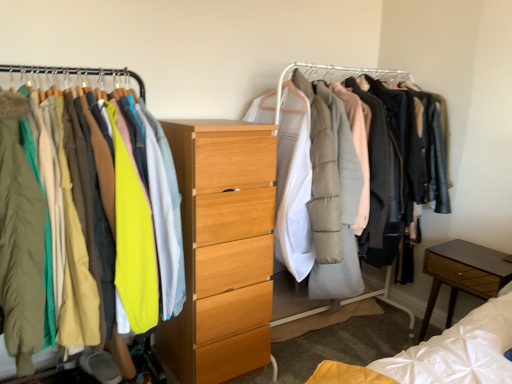
You are a GUI agent. You are given a task and a screenshot of the screen. Output one action in this format:
    pyautogui.click(x=<x>, y=<y>)
    Task: Click on the matte green coat at left, the 1th clothing positioned from the front
    The image size is (512, 384).
    Given the screenshot: What is the action you would take?
    pyautogui.click(x=20, y=240)

The image size is (512, 384). What do you see at coordinates (463, 274) in the screenshot?
I see `brown wood nightstand at lower right` at bounding box center [463, 274].

The image size is (512, 384). What do you see at coordinates (222, 249) in the screenshot?
I see `light wood chest of drawers at center` at bounding box center [222, 249].

The height and width of the screenshot is (384, 512). Find the location of `matte yellow jacket at left, the 3th clothing in the front-to-back sequence`. matte yellow jacket at left, the 3th clothing in the front-to-back sequence is located at coordinates (133, 240).

Is matte green coat at left, the 1th clothing positioned from the front, further to camera compared to matte yellow jacket at left, placed as the second clothing when sorted from front to back?

No, matte green coat at left, the 1th clothing positioned from the front, is in front of matte yellow jacket at left, placed as the second clothing when sorted from front to back.

Can you tell me how much matte green coat at left, the 1th clothing positioned from the front, and matte yellow jacket at left, placed as the second clothing when sorted from front to back, differ in facing direction?

The angle between the facing direction of matte green coat at left, the 1th clothing positioned from the front, and the facing direction of matte yellow jacket at left, placed as the second clothing when sorted from front to back, is 1.61 degrees.

Would you say matte green coat at left, the 1th clothing positioned from the front, is outside matte yellow jacket at left, the 2th clothing when ordered from back to front?

No, matte green coat at left, the 1th clothing positioned from the front, is not entirely external to matte yellow jacket at left, the 2th clothing when ordered from back to front.

Consider the image. From the image's perspective, does matte green coat at left, the 1th clothing positioned from the front, appear lower than matte yellow jacket at left, placed as the second clothing when sorted from front to back?

No.

From a real-world perspective, relative to matte white coat rack at center, is matte yellow jacket at left, placed as the 1th clothing when sorted from back to front, vertically above or below?

From a real-world perspective, matte yellow jacket at left, placed as the 1th clothing when sorted from back to front, is physically above matte white coat rack at center.

How different are the orientations of matte yellow jacket at left, the 3th clothing in the front-to-back sequence, and matte white coat rack at center in degrees?

0.515 degrees separate the facing orientations of matte yellow jacket at left, the 3th clothing in the front-to-back sequence, and matte white coat rack at center.

Is matte yellow jacket at left, the 3th clothing in the front-to-back sequence, positioned far away from matte white coat rack at center?

They are positioned close to each other.

Considering the relative sizes of matte yellow jacket at left, placed as the 1th clothing when sorted from back to front, and matte white coat rack at center in the image provided, is matte yellow jacket at left, placed as the 1th clothing when sorted from back to front, taller than matte white coat rack at center?

No, matte yellow jacket at left, placed as the 1th clothing when sorted from back to front, is not taller than matte white coat rack at center.

From the picture: Between matte yellow jacket at left, the 3th clothing in the front-to-back sequence, and matte yellow jacket at left, the 2th clothing when ordered from back to front, which one has smaller width?

matte yellow jacket at left, the 2th clothing when ordered from back to front, is thinner.

Which is correct: matte yellow jacket at left, the 3th clothing in the front-to-back sequence, is inside matte yellow jacket at left, the 2th clothing when ordered from back to front, or outside of it?

matte yellow jacket at left, the 3th clothing in the front-to-back sequence, is spatially positioned inside matte yellow jacket at left, the 2th clothing when ordered from back to front.

Considering the positions of objects matte yellow jacket at left, placed as the second clothing when sorted from front to back, and matte yellow jacket at left, the 3th clothing in the front-to-back sequence, in the image provided, who is behind, matte yellow jacket at left, placed as the second clothing when sorted from front to back, or matte yellow jacket at left, the 3th clothing in the front-to-back sequence,?

matte yellow jacket at left, the 3th clothing in the front-to-back sequence.

Who is shorter, matte yellow jacket at left, the 2th clothing when ordered from back to front, or matte yellow jacket at left, the 3th clothing in the front-to-back sequence?

With less height is matte yellow jacket at left, the 3th clothing in the front-to-back sequence.

From a real-world perspective, is matte yellow jacket at left, placed as the second clothing when sorted from front to back, above or below matte yellow jacket at left, placed as the 1th clothing when sorted from back to front?

matte yellow jacket at left, placed as the second clothing when sorted from front to back, is below matte yellow jacket at left, placed as the 1th clothing when sorted from back to front.

Is matte yellow jacket at left, the 2th clothing when ordered from back to front, thinner than matte yellow jacket at left, the 3th clothing in the front-to-back sequence?

Yes, matte yellow jacket at left, the 2th clothing when ordered from back to front, is thinner than matte yellow jacket at left, the 3th clothing in the front-to-back sequence.

Is matte white coat rack at center in front of or behind brown wood nightstand at lower right in the image?

In the image, matte white coat rack at center appears in front of brown wood nightstand at lower right.

Which of these two, matte white coat rack at center or brown wood nightstand at lower right, is wider?

Wider between the two is matte white coat rack at center.

Looking at this image, is the surface of matte white coat rack at center in direct contact with brown wood nightstand at lower right?

No.

Based on the photo, is matte white coat rack at center shorter than brown wood nightstand at lower right?

No.

Considering the sizes of objects matte white coat rack at center and light wood chest of drawers at center in the image provided, who is bigger, matte white coat rack at center or light wood chest of drawers at center?

matte white coat rack at center is bigger.

From the image's perspective, is matte white coat rack at center located beneath light wood chest of drawers at center?

Incorrect, from the image's perspective, matte white coat rack at center is higher than light wood chest of drawers at center.

Is matte white coat rack at center not within light wood chest of drawers at center?

Yes, matte white coat rack at center is outside of light wood chest of drawers at center.

From the image's perspective, which object appears higher, brown wood nightstand at lower right or matte green coat at left, the 1th clothing positioned from the front?

From the image's view, matte green coat at left, the 1th clothing positioned from the front, is above.

Can you see brown wood nightstand at lower right touching matte green coat at left, the 3th clothing when ordered from back to front?

brown wood nightstand at lower right is not next to matte green coat at left, the 3th clothing when ordered from back to front, and they're not touching.

Which object is wider, brown wood nightstand at lower right or matte green coat at left, the 1th clothing positioned from the front?

With larger width is matte green coat at left, the 1th clothing positioned from the front.

Is point (459, 248) closer or farther from the camera than point (42, 277)?

Clearly, point (459, 248) is more distant from the camera than point (42, 277).

Starting from the matte green coat at left, the 1th clothing positioned from the front, which clothing is the 1st one behind? Please provide its 2D coordinates.

[(71, 219)]

In the image, there is a matte yellow jacket at left, placed as the 1th clothing when sorted from back to front. What are the coordinates of `closet below it (from a real-world perspective)` in the screenshot? It's located at (309, 83).

When comparing their distances from brown wood nightstand at lower right, does light wood chest of drawers at center or matte yellow jacket at left, the 3th clothing in the front-to-back sequence, seem closer?

Among the two, light wood chest of drawers at center is located nearer to brown wood nightstand at lower right.

When comparing their distances from matte green coat at left, the 1th clothing positioned from the front, does matte yellow jacket at left, placed as the second clothing when sorted from front to back, or light wood chest of drawers at center seem closer?

The object closer to matte green coat at left, the 1th clothing positioned from the front, is matte yellow jacket at left, placed as the second clothing when sorted from front to back.

Which object lies further to the anchor point light wood chest of drawers at center, brown wood nightstand at lower right or matte green coat at left, the 1th clothing positioned from the front?

Among the two, brown wood nightstand at lower right is located further to light wood chest of drawers at center.

Looking at the image, which one is located closer to matte white coat rack at center, matte yellow jacket at left, the 3th clothing in the front-to-back sequence, or matte green coat at left, the 1th clothing positioned from the front?

matte yellow jacket at left, the 3th clothing in the front-to-back sequence.

Based on their spatial positions, is light wood chest of drawers at center or matte green coat at left, the 1th clothing positioned from the front, closer to matte white coat rack at center?

Based on the image, light wood chest of drawers at center appears to be nearer to matte white coat rack at center.

Based on their spatial positions, is matte green coat at left, the 3th clothing when ordered from back to front, or matte white coat rack at center further from light wood chest of drawers at center?

matte green coat at left, the 3th clothing when ordered from back to front, is positioned further to the anchor light wood chest of drawers at center.

Which object lies further to the anchor point matte green coat at left, the 3th clothing when ordered from back to front, matte white coat rack at center or matte yellow jacket at left, placed as the 1th clothing when sorted from back to front?

matte white coat rack at center lies further to matte green coat at left, the 3th clothing when ordered from back to front, than the other object.

Considering their positions, is matte yellow jacket at left, placed as the second clothing when sorted from front to back, positioned closer to matte yellow jacket at left, placed as the 1th clothing when sorted from back to front, than light wood chest of drawers at center?

matte yellow jacket at left, placed as the second clothing when sorted from front to back.

Find the location of a particular element. The image size is (512, 384). clothing located between matte yellow jacket at left, placed as the second clothing when sorted from front to back, and light wood chest of drawers at center in the left-right direction is located at coordinates (133, 240).

Find the location of `clothing between matte green coat at left, the 3th clothing when ordered from back to front, and matte yellow jacket at left, the 3th clothing in the front-to-back sequence, from front to back`. clothing between matte green coat at left, the 3th clothing when ordered from back to front, and matte yellow jacket at left, the 3th clothing in the front-to-back sequence, from front to back is located at coordinates (71, 219).

At what (x,y) coordinates should I click in order to perform the action: click on the chest of drawers situated between matte green coat at left, the 1th clothing positioned from the front, and matte white coat rack at center from left to right. Please return your answer as a coordinate pair (x, y). The image size is (512, 384). Looking at the image, I should click on (222, 249).

Find the location of a particular element. clothing located between matte yellow jacket at left, placed as the second clothing when sorted from front to back, and brown wood nightstand at lower right in the left-right direction is located at coordinates (133, 240).